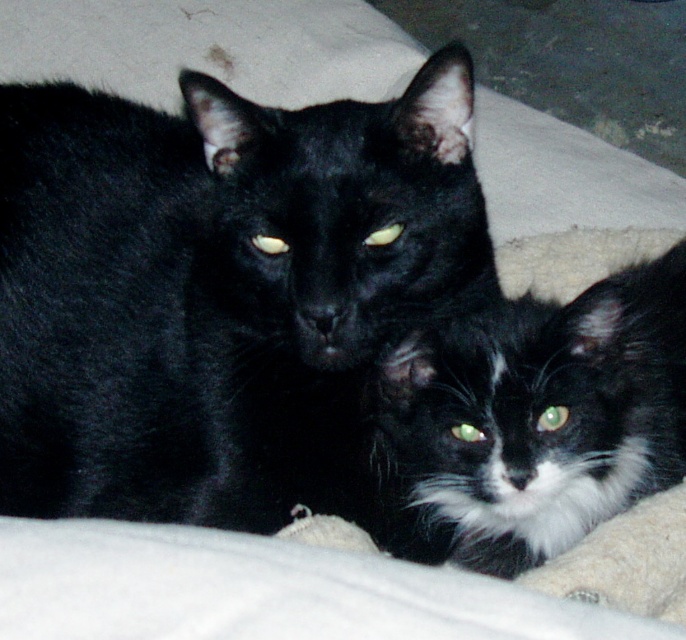
Does point (460, 140) come in front of point (549, 554)?

Yes, it is.

Does black fur cat at center lie in front of black fluffy cat at center?

Yes, black fur cat at center is in front of black fluffy cat at center.

Which is behind, point (69, 214) or point (549, 458)?

The point (69, 214) is more distant.

The width and height of the screenshot is (686, 640). In order to click on black fur cat at center in this screenshot , I will do `click(220, 291)`.